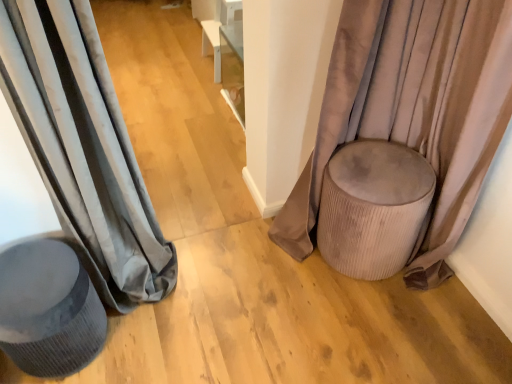
You are a GUI agent. You are given a task and a screenshot of the screen. Output one action in this format:
    pyautogui.click(x=<x>, y=<y>)
    Task: Click on the vacant area that lies to the right of matte gray curtain at left, the 1th curtain viewed from the left
    The height and width of the screenshot is (384, 512).
    Given the screenshot: What is the action you would take?
    pyautogui.click(x=234, y=283)